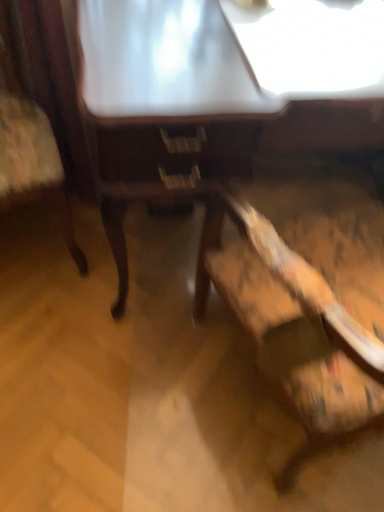
Question: Is wooden table at center facing towards wooden chair at left, the first chair positioned from the left?

Choices:
 (A) no
 (B) yes

Answer: (A)

Question: Is wooden table at center to the right of wooden chair at left, the first chair positioned from the left, from the viewer's perspective?

Choices:
 (A) yes
 (B) no

Answer: (A)

Question: From a real-world perspective, is wooden table at center beneath wooden chair at left, placed as the second chair when sorted from right to left?

Choices:
 (A) yes
 (B) no

Answer: (A)

Question: Considering the relative sizes of wooden table at center and wooden chair at left, the first chair positioned from the left, in the image provided, is wooden table at center thinner than wooden chair at left, the first chair positioned from the left,?

Choices:
 (A) yes
 (B) no

Answer: (B)

Question: Is wooden table at center placed right next to wooden chair at left, placed as the second chair when sorted from right to left?

Choices:
 (A) yes
 (B) no

Answer: (B)

Question: Is wooden table at center not near wooden chair at left, placed as the second chair when sorted from right to left?

Choices:
 (A) yes
 (B) no

Answer: (B)

Question: Considering the relative sizes of wooden chair at left, placed as the second chair when sorted from right to left, and wooden chair at lower right, the 2th chair from the left, in the image provided, is wooden chair at left, placed as the second chair when sorted from right to left, shorter than wooden chair at lower right, the 2th chair from the left,?

Choices:
 (A) yes
 (B) no

Answer: (A)

Question: Is wooden chair at left, placed as the second chair when sorted from right to left, aimed at wooden chair at lower right, which is the 1th chair from right to left?

Choices:
 (A) yes
 (B) no

Answer: (B)

Question: Is wooden chair at left, the first chair positioned from the left, thinner than wooden chair at lower right, the 2th chair from the left?

Choices:
 (A) no
 (B) yes

Answer: (B)

Question: From the image's perspective, is wooden chair at left, placed as the second chair when sorted from right to left, located beneath wooden chair at lower right, which is the 1th chair from right to left?

Choices:
 (A) no
 (B) yes

Answer: (A)

Question: Considering the relative positions of wooden chair at left, the first chair positioned from the left, and wooden chair at lower right, which is the 1th chair from right to left, in the image provided, is wooden chair at left, the first chair positioned from the left, to the right of wooden chair at lower right, which is the 1th chair from right to left, from the viewer's perspective?

Choices:
 (A) no
 (B) yes

Answer: (A)

Question: Does wooden chair at left, the first chair positioned from the left, appear on the left side of wooden chair at lower right, which is the 1th chair from right to left?

Choices:
 (A) no
 (B) yes

Answer: (B)

Question: Is wooden chair at lower right, the 2th chair from the left, wider than wooden table at center?

Choices:
 (A) no
 (B) yes

Answer: (B)